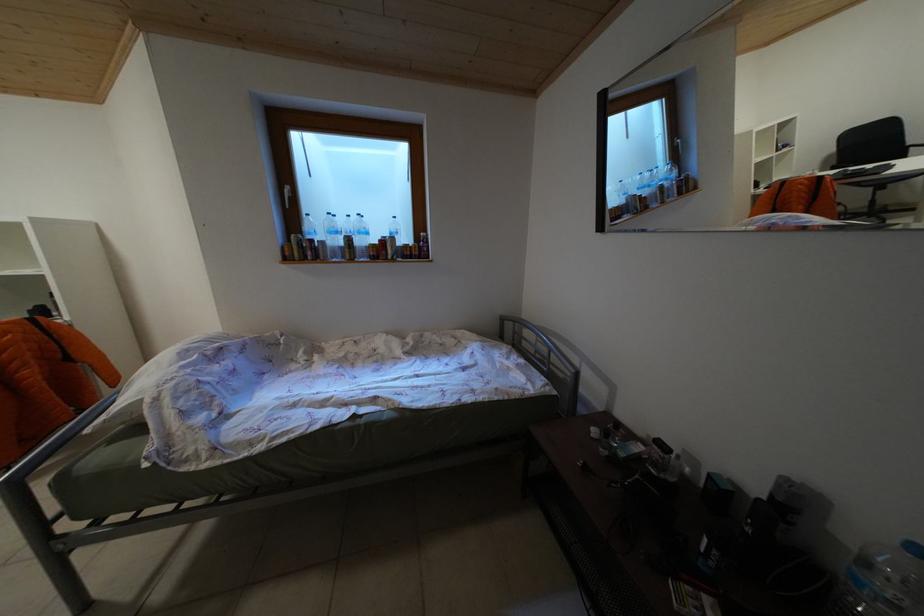
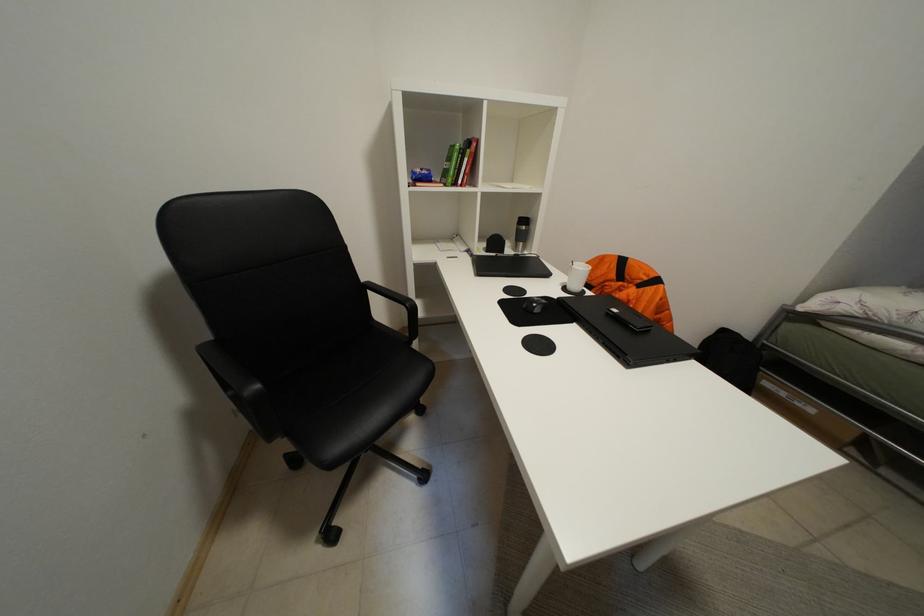
Question: In a continuous first-person perspective shot, in which direction is the camera moving?

Choices:
 (A) Left
 (B) Right
 (C) Forward
 (D) Backward

Answer: (A)